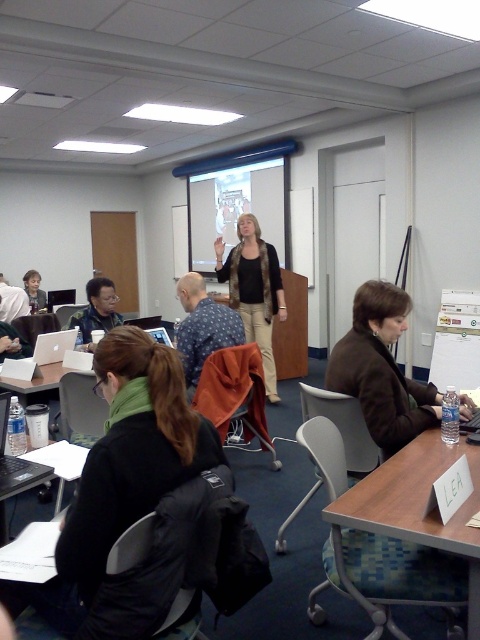
Question: Can you confirm if black matte laptop at lower left is positioned to the left of matte black jacket at center?

Choices:
 (A) no
 (B) yes

Answer: (A)

Question: Which of these objects is positioned closest to the black plastic laptop at center?

Choices:
 (A) matte black laptop at left
 (B) black matte laptop at lower left

Answer: (B)

Question: From the image, what is the correct spatial relationship of black fleece jacket at lower left in relation to silver metallic laptop at center?

Choices:
 (A) above
 (B) below

Answer: (B)

Question: Which point is farther from the camera taking this photo?

Choices:
 (A) (252, 246)
 (B) (37, 308)

Answer: (B)

Question: Can you confirm if brown leather jacket at lower right is bigger than matte black sweater at center?

Choices:
 (A) no
 (B) yes

Answer: (A)

Question: Among these points, which one is farthest from the camera?

Choices:
 (A) (28, 380)
 (B) (66, 292)
 (C) (21, 467)

Answer: (B)